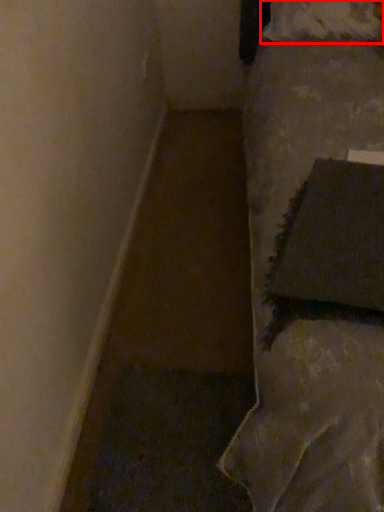
Question: From the image's perspective, where is pillow (annotated by the red box) located relative to pillow?

Choices:
 (A) above
 (B) below

Answer: (A)